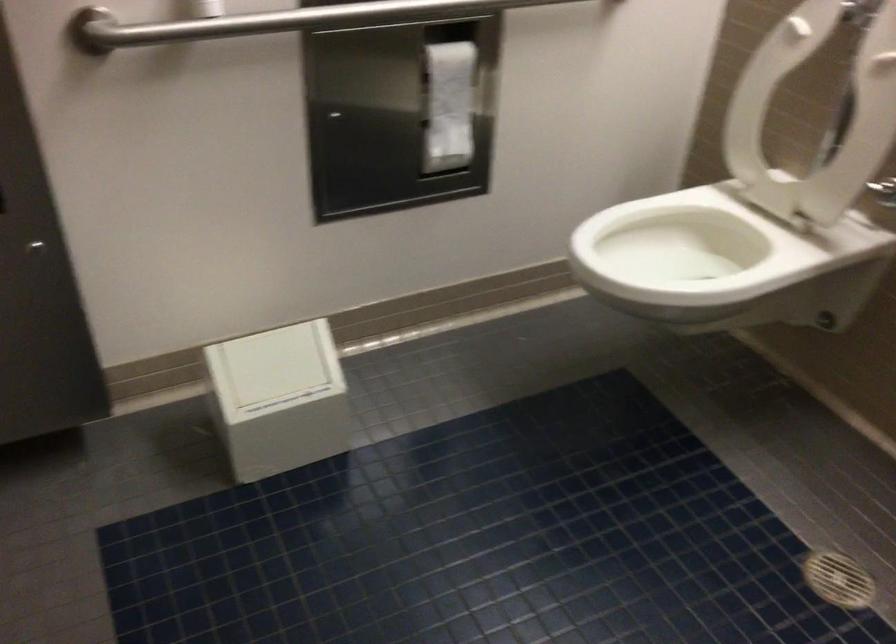
What do you see at coordinates (450, 98) in the screenshot? I see `the toilet paper` at bounding box center [450, 98].